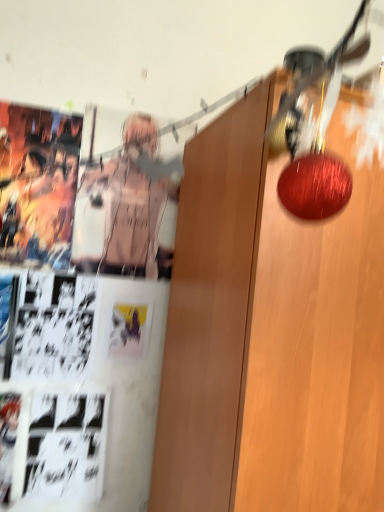
What is the approximate height of shiny wood door at upper right?

shiny wood door at upper right is 1.11 meters tall.

At what (x,y) coordinates should I click in order to perform the action: click on shiny wood door at upper right. Please return your answer as a coordinate pair (x, y). This screenshot has height=512, width=384. Looking at the image, I should click on 317,348.

Describe the element at coordinates (317, 348) in the screenshot. The height and width of the screenshot is (512, 384). I see `shiny wood door at upper right` at that location.

Find the location of a particular element. shiny wood door at upper right is located at coordinates (317, 348).